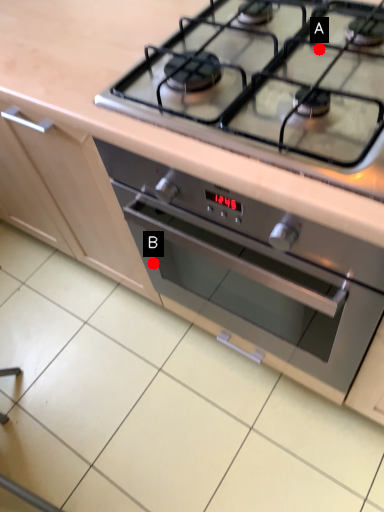
Question: Two points are circled on the image, labeled by A and B beside each circle. Among these points, which one is nearest to the camera?

Choices:
 (A) A is closer
 (B) B is closer

Answer: (A)